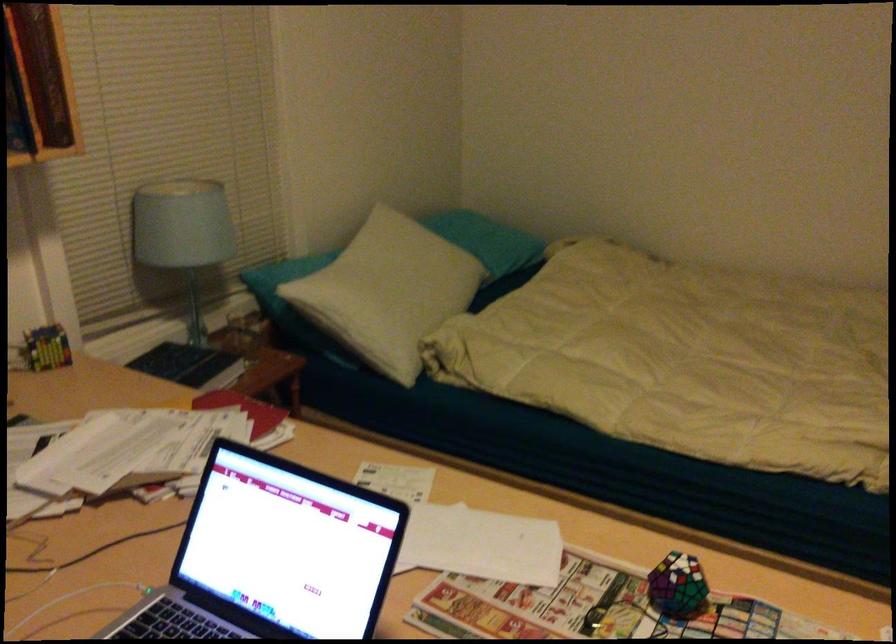
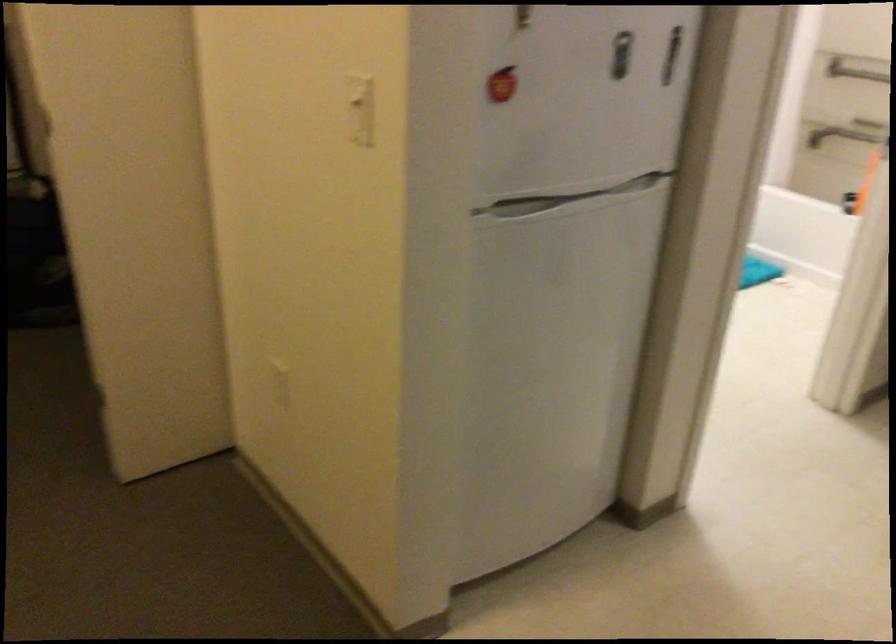
The first image is from the beginning of the video and the second image is from the end. How did the camera likely rotate when shooting the video?

The camera's rotation is toward right-down.